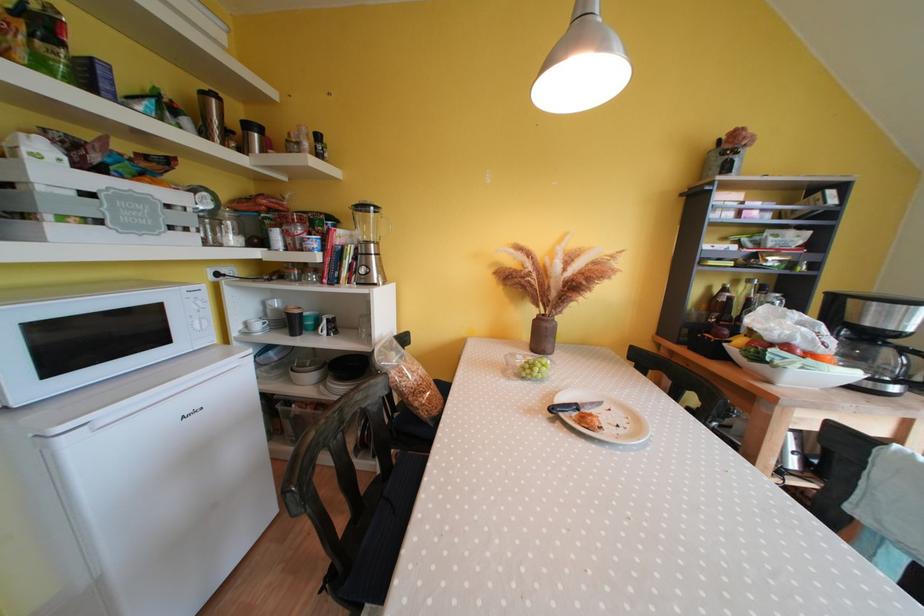
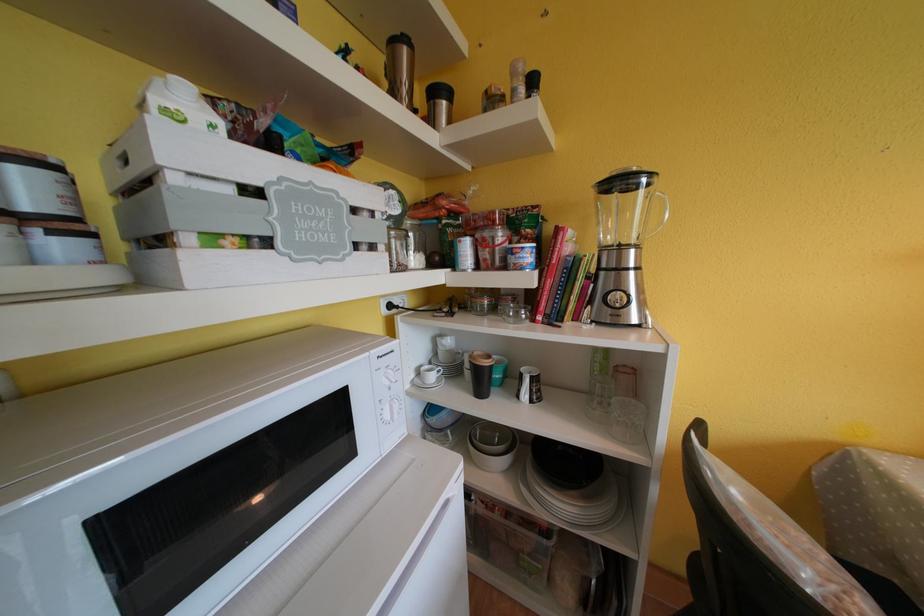
Find the pixel in the second image that matches [264,330] in the first image.

(439, 381)